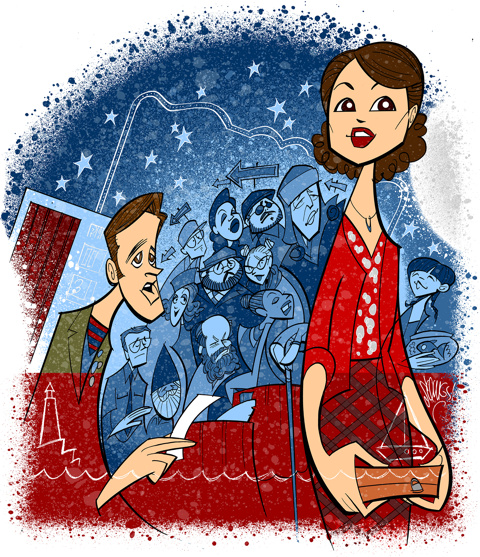
You are a GUI agent. You are given a task and a screenshot of the screen. Output one action in this format:
    pyautogui.click(x=<x>, y=<y>)
    Task: Click on the fish bowl with fish
    
    Given the screenshot: What is the action you would take?
    pyautogui.click(x=447, y=348), pyautogui.click(x=425, y=340)